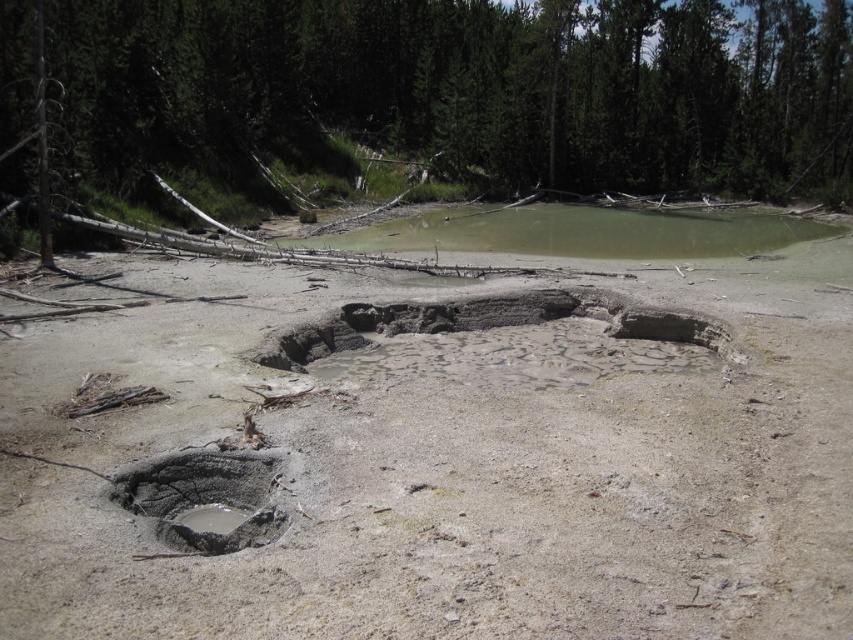
Question: Based on their relative distances, which object is farther from the muddy clay hole at lower left?

Choices:
 (A) green leafy tree at upper center
 (B) muddy water at center

Answer: (A)

Question: Considering the real-world distances, which object is closest to the muddy clay hole at lower left?

Choices:
 (A) muddy water at center
 (B) green leafy tree at upper center

Answer: (A)

Question: From the image, what is the correct spatial relationship of green leafy tree at upper center in relation to muddy clay hole at lower left?

Choices:
 (A) right
 (B) left

Answer: (A)

Question: Is muddy water at center behind muddy clay hole at lower left?

Choices:
 (A) no
 (B) yes

Answer: (B)

Question: Estimate the real-world distances between objects in this image. Which object is farther from the muddy water at center?

Choices:
 (A) green leafy tree at upper center
 (B) muddy clay hole at lower left

Answer: (B)

Question: In this image, where is green leafy tree at upper center located relative to muddy water at center?

Choices:
 (A) left
 (B) right

Answer: (A)